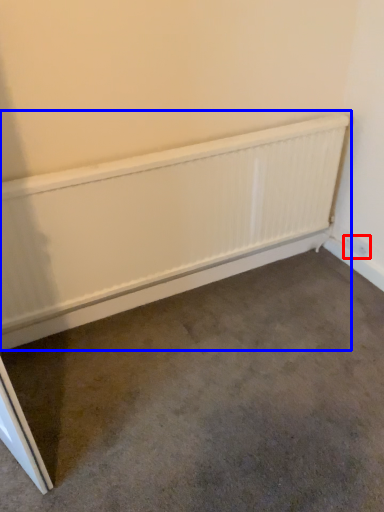
Question: Which of the following is the closest to the observer, electric outlet (highlighted by a red box) or radiator (highlighted by a blue box)?

Choices:
 (A) electric outlet
 (B) radiator

Answer: (B)